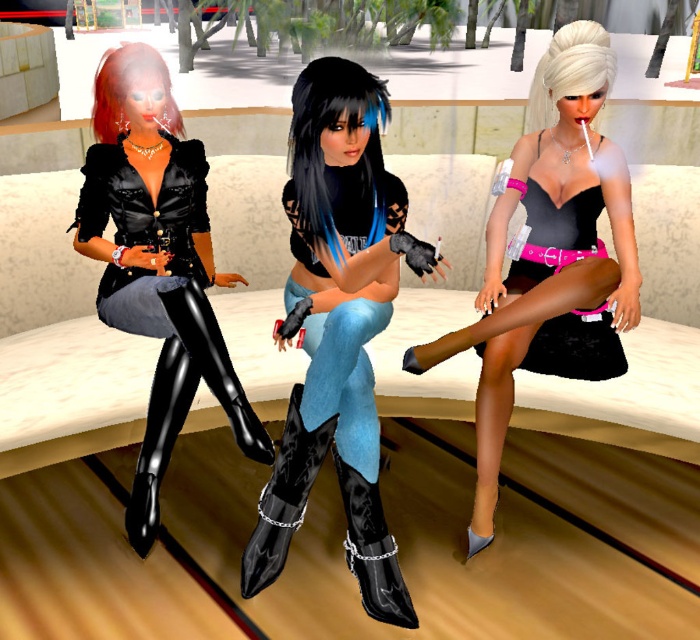
Question: Among these objects, which one is farthest from the camera?

Choices:
 (A) black patent leather boot at center
 (B) blue denim jeans at center
 (C) glossy patent leather boot at center

Answer: (A)

Question: Based on their relative distances, which object is farther from the glossy patent leather boot at center?

Choices:
 (A) shiny black boots at center
 (B) black leather boot at lower left
 (C) shiny red hair at center

Answer: (C)

Question: Does blue denim jeans at center appear on the left side of glossy black boot at center?

Choices:
 (A) no
 (B) yes

Answer: (A)

Question: Which point is farther from the camera taking this photo?

Choices:
 (A) (360, 84)
 (B) (358, 307)

Answer: (B)

Question: Can you confirm if blue denim jeans at center is positioned above black patent leather boot at center?

Choices:
 (A) yes
 (B) no

Answer: (A)

Question: From the image, what is the correct spatial relationship of matte black dress at center in relation to shiny black boots at left?

Choices:
 (A) right
 (B) left

Answer: (A)